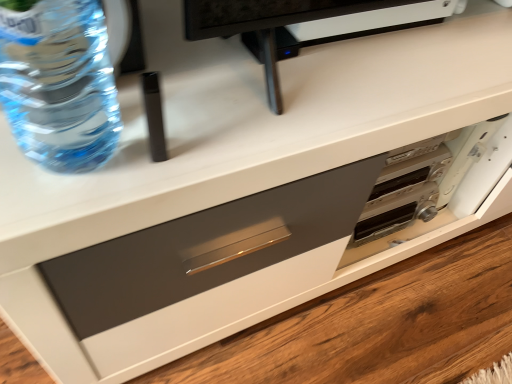
Question: Is translucent plastic bottle at upper left at the left side of matte gray drawer at center?

Choices:
 (A) yes
 (B) no

Answer: (A)

Question: Is translucent plastic bottle at upper left thinner than matte gray drawer at center?

Choices:
 (A) yes
 (B) no

Answer: (A)

Question: From a real-world perspective, is translucent plastic bottle at upper left on matte gray drawer at center?

Choices:
 (A) no
 (B) yes

Answer: (B)

Question: From a real-world perspective, is translucent plastic bottle at upper left below matte gray drawer at center?

Choices:
 (A) yes
 (B) no

Answer: (B)

Question: Is translucent plastic bottle at upper left positioned with its back to matte gray drawer at center?

Choices:
 (A) yes
 (B) no

Answer: (B)

Question: Considering the relative sizes of translucent plastic bottle at upper left and matte gray drawer at center in the image provided, is translucent plastic bottle at upper left taller than matte gray drawer at center?

Choices:
 (A) yes
 (B) no

Answer: (A)

Question: Can you confirm if matte gray drawer at center is taller than translucent plastic bottle at upper left?

Choices:
 (A) no
 (B) yes

Answer: (A)

Question: Can you confirm if matte gray drawer at center is shorter than translucent plastic bottle at upper left?

Choices:
 (A) yes
 (B) no

Answer: (A)

Question: Does matte gray drawer at center turn towards translucent plastic bottle at upper left?

Choices:
 (A) yes
 (B) no

Answer: (B)

Question: Is translucent plastic bottle at upper left a part of matte gray drawer at center?

Choices:
 (A) yes
 (B) no

Answer: (B)

Question: Is matte gray drawer at center bigger than translucent plastic bottle at upper left?

Choices:
 (A) yes
 (B) no

Answer: (A)

Question: From a real-world perspective, is matte gray drawer at center located higher than translucent plastic bottle at upper left?

Choices:
 (A) no
 (B) yes

Answer: (A)

Question: From the image's perspective, relative to matte gray drawer at center, is translucent plastic bottle at upper left above or below?

Choices:
 (A) above
 (B) below

Answer: (A)